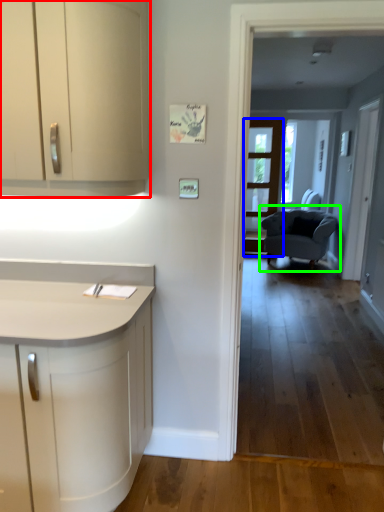
Question: Based on their relative distances, which object is farther from cabinetry (highlighted by a red box)? Choose from screen door (highlighted by a blue box) and chair (highlighted by a green box).

Choices:
 (A) screen door
 (B) chair

Answer: (A)